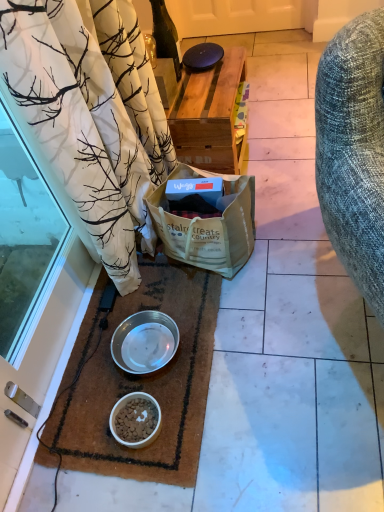
Question: Is green glass bottle at upper center wider or thinner than metallic silver bowl at lower center, arranged as the first bowl when viewed from the top?

Choices:
 (A) wide
 (B) thin

Answer: (B)

Question: Based on their sizes in the image, would you say green glass bottle at upper center is bigger or smaller than metallic silver bowl at lower center, arranged as the first bowl when viewed from the top?

Choices:
 (A) big
 (B) small

Answer: (B)

Question: Estimate the real-world distances between objects in this image. Which object is closer to the metallic silver bowl at lower center, arranged as the first bowl when viewed from the top?

Choices:
 (A) black glossy tile at center
 (B) green glass bottle at upper center
 (C) white cardboard box at center
 (D) transparent glass door at lower left
 (E) white matte bowl at lower center, which is the 2th bowl from top to bottom

Answer: (E)

Question: Based on their relative distances, which object is nearer to the transparent glass door at lower left?

Choices:
 (A) brown woven mat at lower left
 (B) metallic silver bowl at lower center, arranged as the first bowl when viewed from the top
 (C) green glass bottle at upper center
 (D) white cardboard box at center
 (E) black glossy tile at center

Answer: (A)